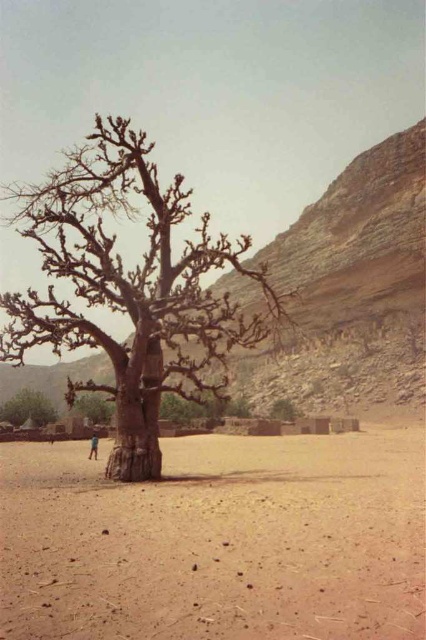
Question: Does brown sandy ground at center have a lesser width compared to brown rough tree at lower left?

Choices:
 (A) no
 (B) yes

Answer: (A)

Question: Does brown rough tree at lower left have a greater width compared to brown rough bark tree at center?

Choices:
 (A) yes
 (B) no

Answer: (A)

Question: Which of the following is the farthest from the observer?

Choices:
 (A) brown rough bark tree at center
 (B) brown sandy ground at center
 (C) brown rough tree at lower left

Answer: (A)

Question: Which point is closer to the camera?

Choices:
 (A) (54, 492)
 (B) (270, 408)
 (C) (34, 403)
 (D) (39, 310)

Answer: (A)

Question: Which point is farther from the camera taking this photo?

Choices:
 (A) (417, 566)
 (B) (282, 410)
 (C) (11, 397)
 (D) (267, 301)

Answer: (C)

Question: Considering the relative positions of brown sandy ground at center and brown rough textured tree at center in the image provided, where is brown sandy ground at center located with respect to brown rough textured tree at center?

Choices:
 (A) above
 (B) below

Answer: (B)